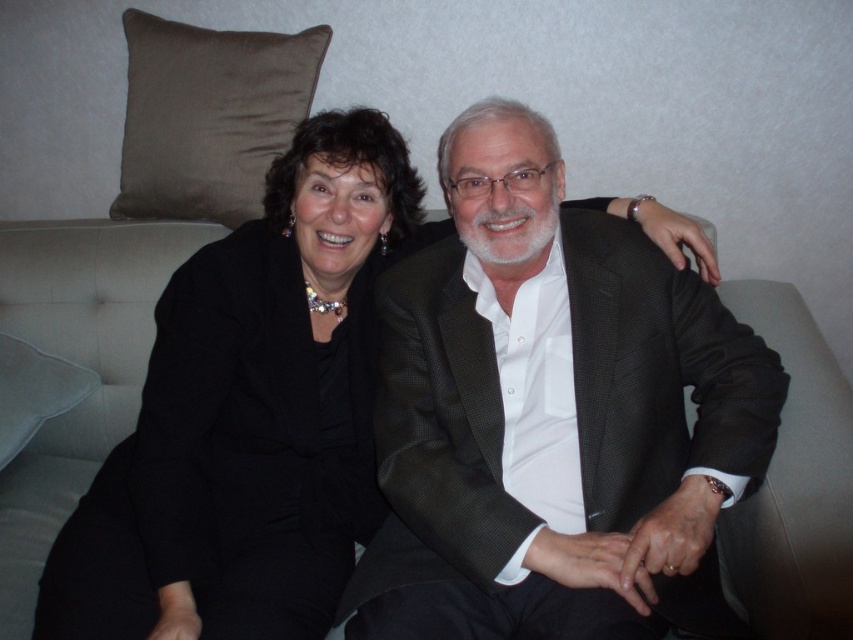
Question: In this image, where is black woolen suit at left located relative to brown suede pillow at upper left?

Choices:
 (A) above
 (B) below

Answer: (B)

Question: Is matte black suit at center to the left of brown suede pillow at upper left from the viewer's perspective?

Choices:
 (A) no
 (B) yes

Answer: (A)

Question: Considering the relative positions of matte black suit at center and white fabric pillow at left in the image provided, where is matte black suit at center located with respect to white fabric pillow at left?

Choices:
 (A) left
 (B) right

Answer: (B)

Question: Which object is farther from the camera taking this photo?

Choices:
 (A) black woolen suit at left
 (B) matte black suit at center
 (C) white fabric pillow at left
 (D) brown suede pillow at upper left

Answer: (D)

Question: Which point is closer to the camera?

Choices:
 (A) (28, 428)
 (B) (138, 548)

Answer: (B)

Question: Among these points, which one is nearest to the camera?

Choices:
 (A) click(x=189, y=90)
 (B) click(x=33, y=390)
 (C) click(x=622, y=448)

Answer: (C)